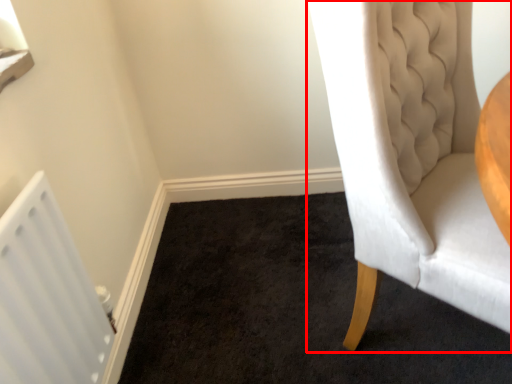
Question: From the image's perspective, where is chair (annotated by the red box) located relative to radiator?

Choices:
 (A) above
 (B) below

Answer: (A)